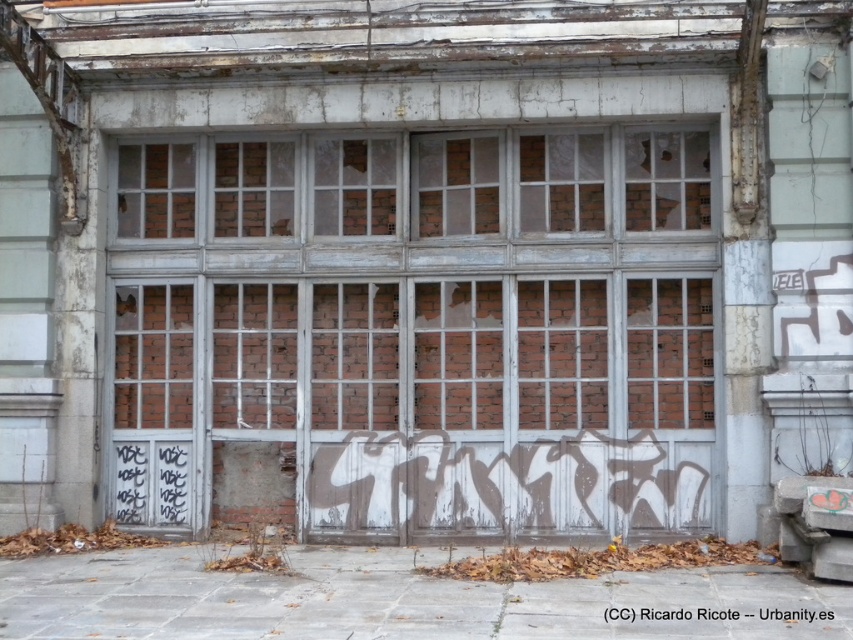
Looking at this image, is the position of brick wall at center less distant than that of brick wall at upper center?

That is True.

Which is above, brick wall at center or brick wall at upper center?

brick wall at center

Between point (370, 189) and point (224, 188), which one is positioned in front?

Point (370, 189) is more forward.

Where is `brick wall at center`? brick wall at center is located at coordinates (354, 186).

In the scene shown: Can you confirm if translucent glass window at center is smaller than brick textured window at center?

Actually, translucent glass window at center might be larger than brick textured window at center.

Identify the location of translucent glass window at center. (456, 184).

Is brick textured window at center closer to camera compared to brick textured window at upper left?

Yes, brick textured window at center is closer to the viewer.

Which is behind, point (543, 189) or point (142, 212)?

Positioned behind is point (142, 212).

Does point (579, 132) come farther from viewer compared to point (189, 193)?

No.

Find the location of `brick textured window at center`. brick textured window at center is located at coordinates (561, 180).